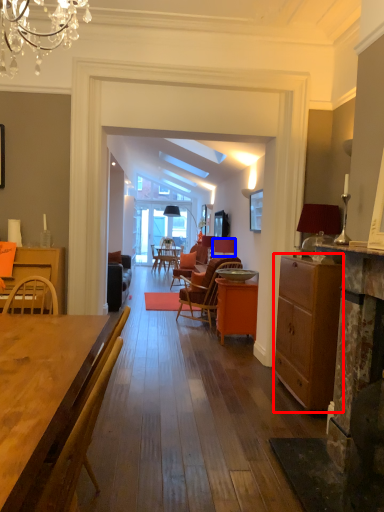
Question: Which object is closer to the camera taking this photo, cabinetry (highlighted by a red box) or loudspeaker (highlighted by a blue box)?

Choices:
 (A) cabinetry
 (B) loudspeaker

Answer: (A)